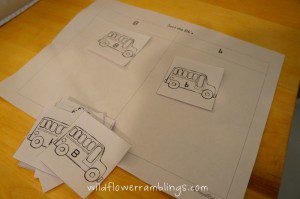
This screenshot has height=199, width=300. I want to click on white square of paper, so click(108, 139).